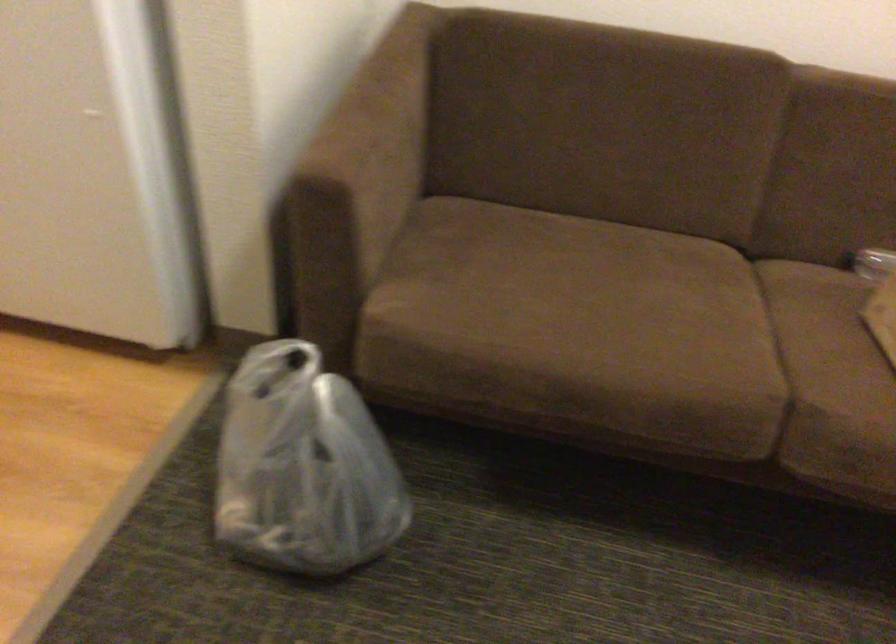
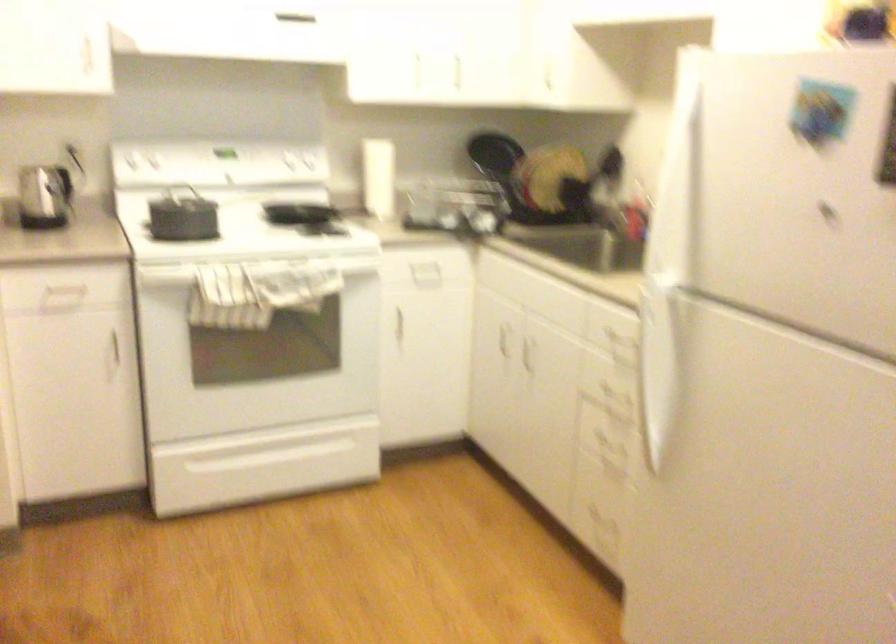
Question: The camera is either moving clockwise (left) or counter-clockwise (right) around the object. The first image is from the beginning of the video and the second image is from the end. Is the camera moving left or right when shooting the video?

Choices:
 (A) Left
 (B) Right

Answer: (B)